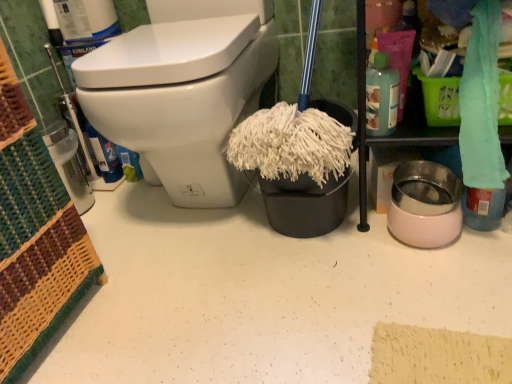
Question: From a real-world perspective, is teal fabric towel at upper right positioned above or below white fluffy mop head at center?

Choices:
 (A) below
 (B) above

Answer: (B)

Question: Which is correct: teal fabric towel at upper right is inside white fluffy mop head at center, or outside of it?

Choices:
 (A) outside
 (B) inside

Answer: (A)

Question: Which is farther from the white fluffy mop head at center?

Choices:
 (A) white glossy toilet at upper left
 (B) translucent plastic bottle at upper right
 (C) teal fabric towel at upper right

Answer: (A)

Question: Considering the real-world distances, which object is farthest from the translucent plastic bottle at upper right?

Choices:
 (A) white fluffy mop head at center
 (B) white glossy toilet at upper left
 (C) teal fabric towel at upper right

Answer: (B)